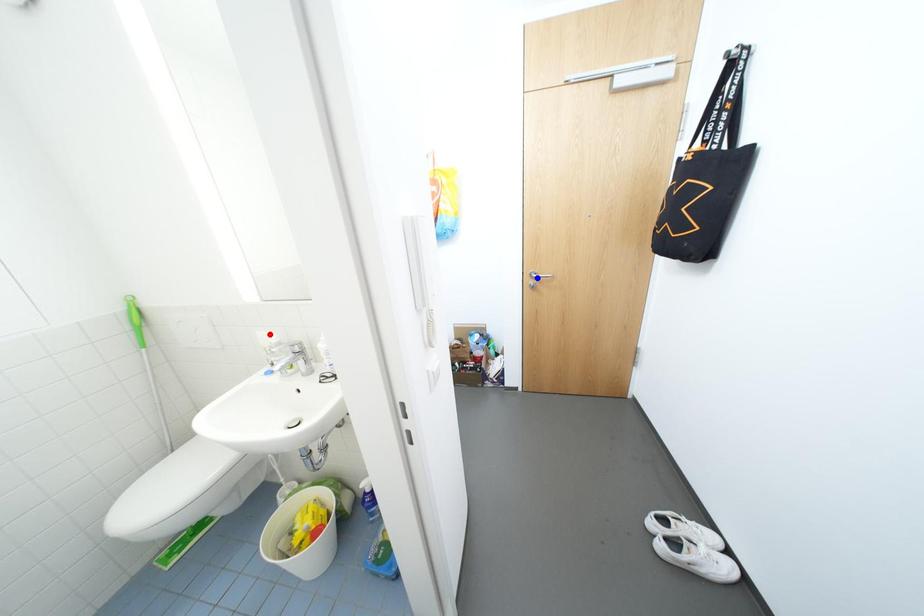
Question: In the image, two points are highlighted. Which point is nearer to the camera? Reply with the corresponding letter.

Choices:
 (A) blue point
 (B) red point

Answer: (B)